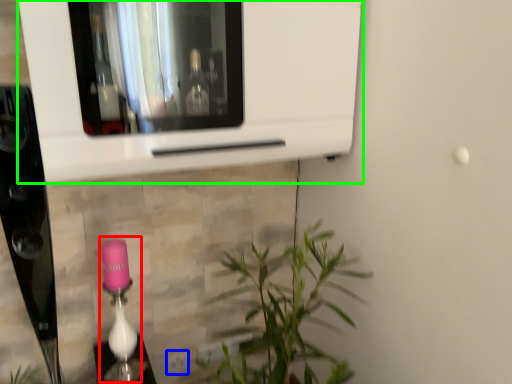
Question: Which object is positioned farthest from lamp (highlighted by a red box)? Select from electric outlet (highlighted by a blue box) and microwave (highlighted by a green box).

Choices:
 (A) electric outlet
 (B) microwave

Answer: (B)